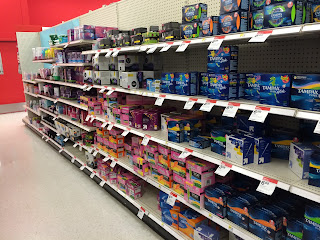
Image resolution: width=320 pixels, height=240 pixels. I want to click on smaller shelves, so click(29, 91), click(50, 80).